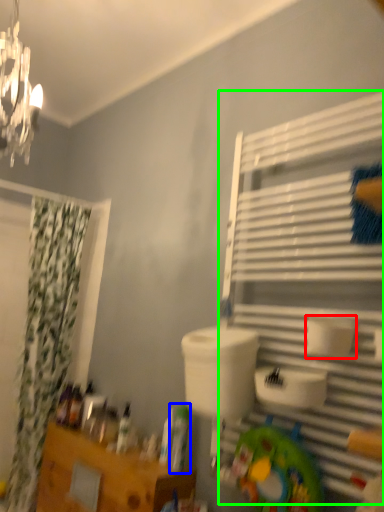
Question: Which is nearer to the toilet paper (highlighted by a red box)? toiletry (highlighted by a blue box) or shelf (highlighted by a green box).

Choices:
 (A) toiletry
 (B) shelf

Answer: (B)